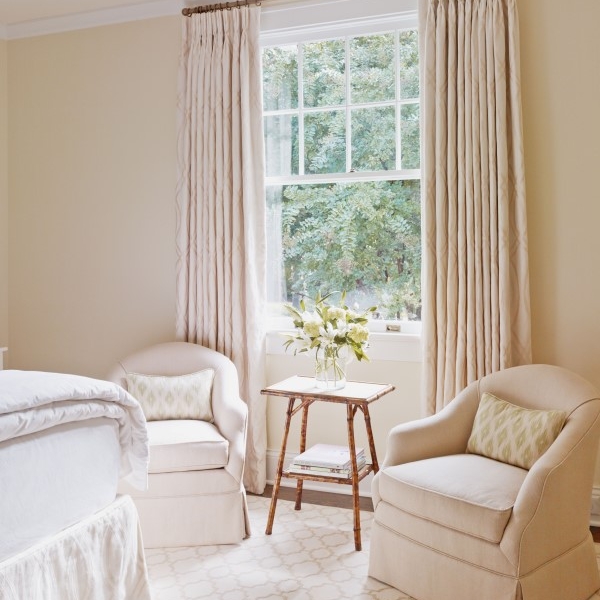
At what (x,y) coordinates should I click in order to perform the action: click on white cornice. Please return your answer as a coordinate pair (x, y). The width and height of the screenshot is (600, 600). Looking at the image, I should click on (98, 14).